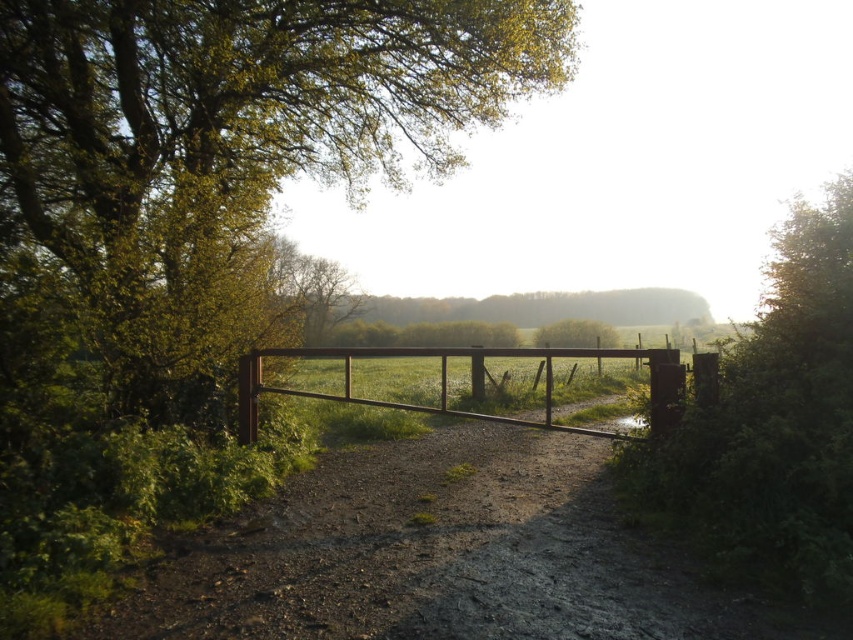
Between green leafy tree at center and brown wooden gate at center, which one is positioned higher?

Positioned higher is green leafy tree at center.

Measure the distance from green leafy tree at center to brown wooden gate at center.

green leafy tree at center and brown wooden gate at center are 3.51 meters apart.

Measure the distance between point (65,163) and camera.

The distance of point (65,163) from camera is 9.58 meters.

Identify the location of green leafy tree at center. (231, 134).